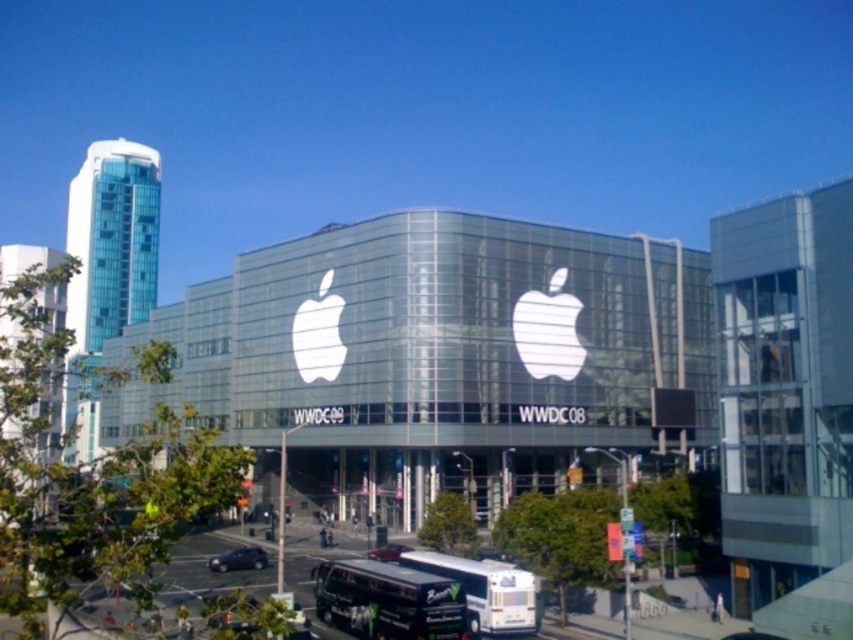
Does point (469, 560) come behind point (258, 550)?

No, it is not.

Between point (479, 563) and point (230, 570), which one is positioned behind?

Point (230, 570)

Does point (517, 593) come in front of point (227, 564)?

Yes, point (517, 593) is closer to viewer.

Where is `white glossy bus at lower center`? This screenshot has width=853, height=640. white glossy bus at lower center is located at coordinates (485, 589).

Does black matte bus at lower center come in front of shiny black car at lower center?

Yes, black matte bus at lower center is in front of shiny black car at lower center.

Where is `black matte bus at lower center`? The height and width of the screenshot is (640, 853). black matte bus at lower center is located at coordinates (387, 600).

I want to click on black matte bus at lower center, so click(x=387, y=600).

Can you confirm if black matte bus at lower center is taller than shiny black sedan at center?

Correct, black matte bus at lower center is much taller as shiny black sedan at center.

Does black matte bus at lower center have a lesser width compared to shiny black sedan at center?

No.

Does point (461, 616) come farther from viewer compared to point (392, 554)?

No, it is not.

Image resolution: width=853 pixels, height=640 pixels. I want to click on black matte bus at lower center, so click(387, 600).